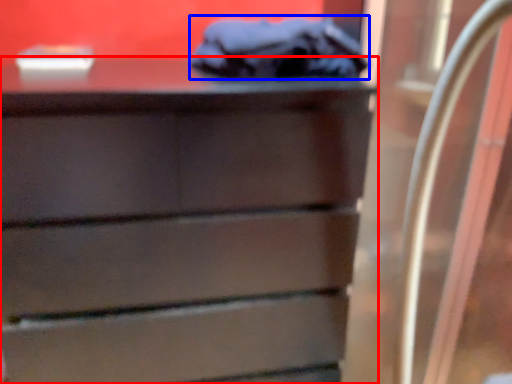
Question: Which of the following is the farthest to the observer, chest of drawers (highlighted by a red box) or scrub (highlighted by a blue box)?

Choices:
 (A) chest of drawers
 (B) scrub

Answer: (B)